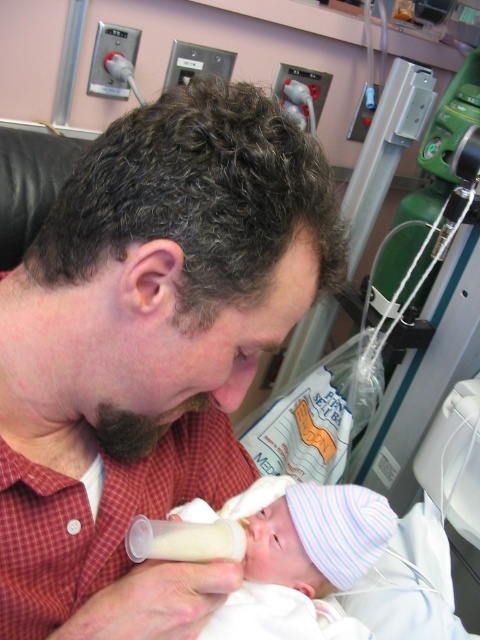
Question: From the image, what is the correct spatial relationship of red checkered shirt at center in relation to white striped knit hat at center?

Choices:
 (A) left
 (B) right

Answer: (A)

Question: Which point is farther to the camera?

Choices:
 (A) white striped knit hat at center
 (B) red checkered shirt at center

Answer: (A)

Question: From the image, what is the correct spatial relationship of red checkered shirt at center in relation to white striped knit hat at center?

Choices:
 (A) left
 (B) right

Answer: (A)

Question: Which point is farther from the camera taking this photo?

Choices:
 (A) (180, 513)
 (B) (36, 490)

Answer: (A)

Question: Considering the relative positions of red checkered shirt at center and white striped knit hat at center in the image provided, where is red checkered shirt at center located with respect to white striped knit hat at center?

Choices:
 (A) right
 (B) left

Answer: (B)